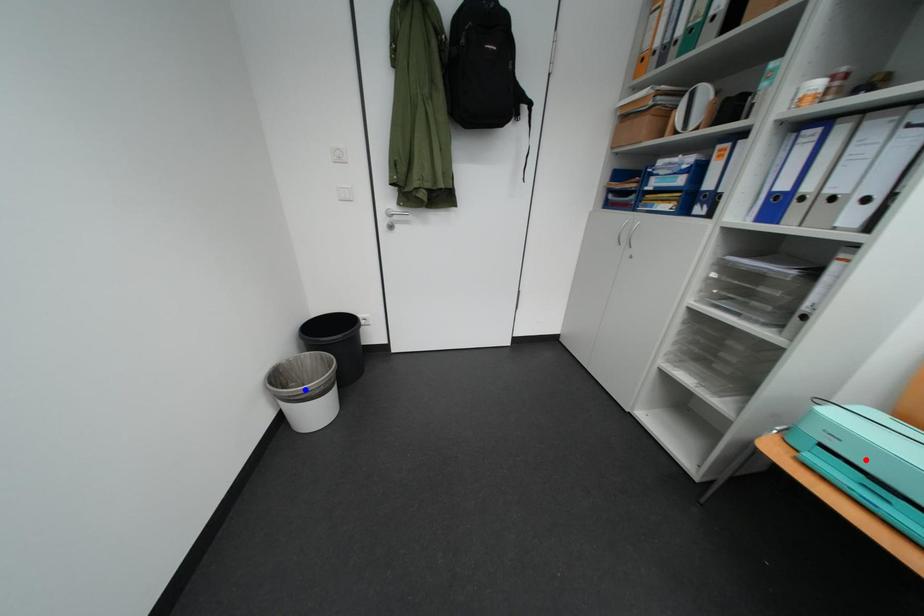
Question: In the image, two points are highlighted. Which point is nearer to the camera? Reply with the corresponding letter.

Choices:
 (A) blue point
 (B) red point

Answer: (B)